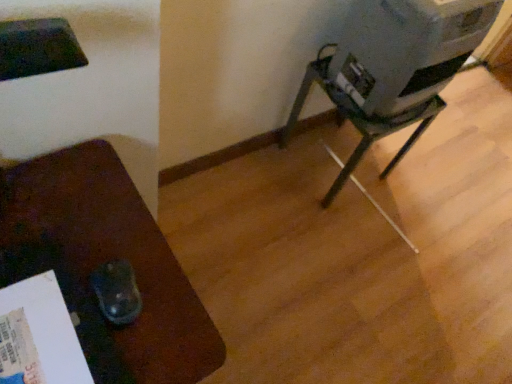
Image resolution: width=512 pixels, height=384 pixels. Find the location of `free space in front of metallic gray projector at center-right, arranged as the 1th furniture when viewed from the right`. free space in front of metallic gray projector at center-right, arranged as the 1th furniture when viewed from the right is located at coordinates (321, 226).